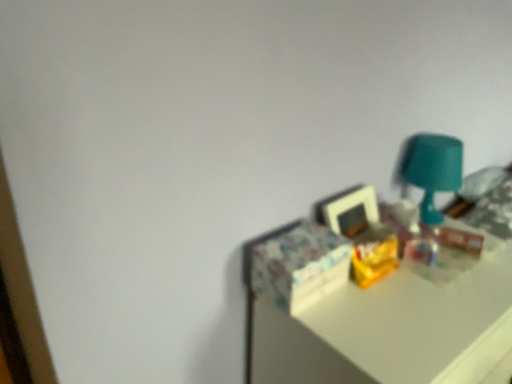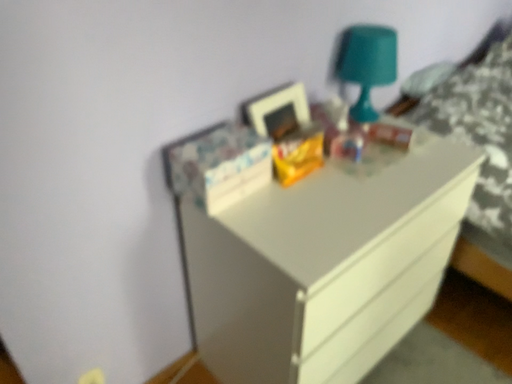
Question: Which way did the camera rotate in the video?

Choices:
 (A) rotated downward
 (B) rotated upward

Answer: (A)